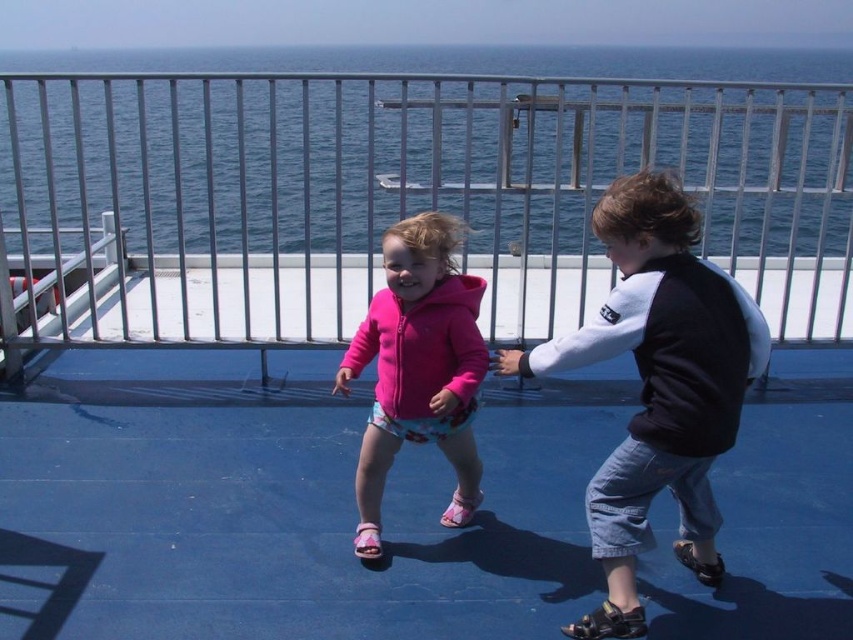
From the picture: You are a photographer trying to capture a candid shot of the two children on the blue deck. You want to ensure both are in focus. If you position yourself so that your camera is aligned with the point at (227, 218) and the point at (618, 348), which point should be closer to your camera to ensure proper focus?

Point (618, 348) is closer to the camera since it is in front of point (227, 218), which is behind it. To ensure both are in focus, the photographer should focus on the closer point (618, 348).

What object is located at the coordinates point (396,196)?

The brushed metal rail at upper center is located at the coordinates point (396,196).